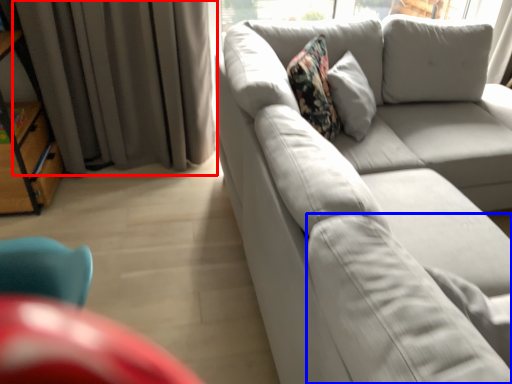
Question: Which of the following is the closest to the observer, curtain (highlighted by a red box) or pillow (highlighted by a blue box)?

Choices:
 (A) curtain
 (B) pillow

Answer: (B)